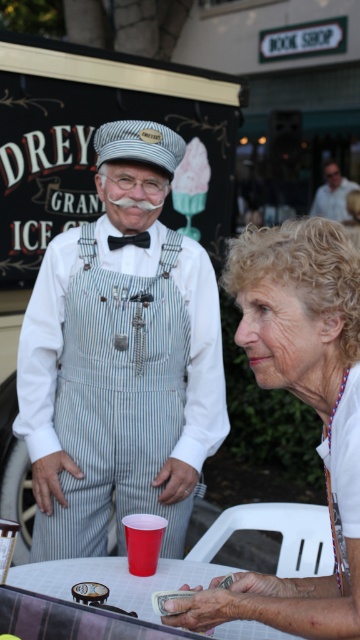
You are a customer at the fair and you see the striped cotton overalls at center and the smooth brown leather wallet at center. Which item is bigger?

The striped cotton overalls at center is larger in size than the smooth brown leather wallet at center.

You are a customer at the fair and see the striped cotton overalls at center and the smooth brown leather wallet at center. Which item is taller?

The striped cotton overalls at center is taller than the smooth brown leather wallet at center.